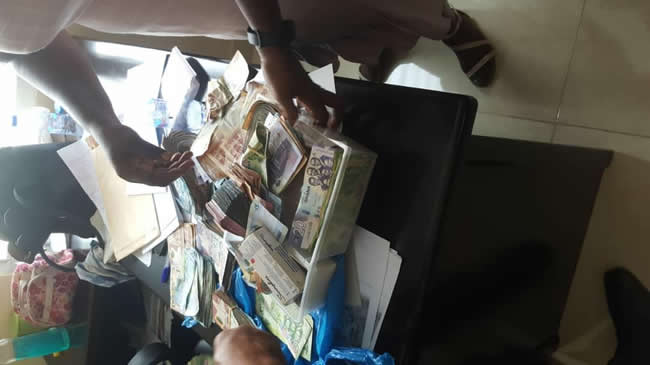
Where is `floor`? The height and width of the screenshot is (365, 650). floor is located at coordinates (593, 75).